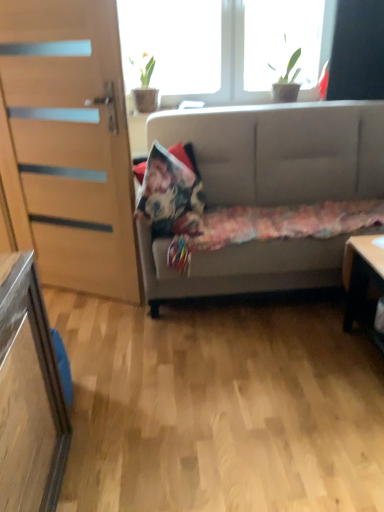
Question: Does light gray fabric couch at center have a lesser height compared to transparent glass window at upper center, which is the 2th window in right-to-left order?

Choices:
 (A) no
 (B) yes

Answer: (A)

Question: Does light gray fabric couch at center have a smaller size compared to transparent glass window at upper center, arranged as the 1th window when viewed from the left?

Choices:
 (A) no
 (B) yes

Answer: (A)

Question: Would you say transparent glass window at upper center, which is the 2th window in right-to-left order, is part of light gray fabric couch at center's contents?

Choices:
 (A) no
 (B) yes

Answer: (A)

Question: Does light gray fabric couch at center have a greater height compared to transparent glass window at upper center, arranged as the 1th window when viewed from the left?

Choices:
 (A) no
 (B) yes

Answer: (B)

Question: Is light gray fabric couch at center wider than transparent glass window at upper center, arranged as the 1th window when viewed from the left?

Choices:
 (A) no
 (B) yes

Answer: (B)

Question: From a real-world perspective, is transparent glass window at upper center, which is the 2th window in right-to-left order, above or below floral fabric pillow at center?

Choices:
 (A) below
 (B) above

Answer: (B)

Question: In terms of width, does transparent glass window at upper center, which is the 2th window in right-to-left order, look wider or thinner when compared to floral fabric pillow at center?

Choices:
 (A) wide
 (B) thin

Answer: (B)

Question: Is transparent glass window at upper center, arranged as the 1th window when viewed from the left, to the left or to the right of floral fabric pillow at center in the image?

Choices:
 (A) left
 (B) right

Answer: (B)

Question: Is transparent glass window at upper center, arranged as the 1th window when viewed from the left, in front of or behind floral fabric pillow at center in the image?

Choices:
 (A) front
 (B) behind

Answer: (B)

Question: In the image, is light brown wood desk at lower right on the left side or the right side of light gray fabric couch at center?

Choices:
 (A) right
 (B) left

Answer: (A)

Question: Is point (359, 250) positioned closer to the camera than point (301, 121)?

Choices:
 (A) closer
 (B) farther

Answer: (A)

Question: Looking at their shapes, would you say light brown wood desk at lower right is wider or thinner than light gray fabric couch at center?

Choices:
 (A) wide
 (B) thin

Answer: (B)

Question: Considering the positions of light brown wood desk at lower right and light gray fabric couch at center in the image, is light brown wood desk at lower right taller or shorter than light gray fabric couch at center?

Choices:
 (A) tall
 (B) short

Answer: (B)

Question: In terms of width, does floral fabric pillow at center look wider or thinner when compared to transparent glass window at upper center, which is the 2th window in right-to-left order?

Choices:
 (A) thin
 (B) wide

Answer: (B)

Question: From the image's perspective, is floral fabric pillow at center positioned above or below transparent glass window at upper center, arranged as the 1th window when viewed from the left?

Choices:
 (A) below
 (B) above

Answer: (A)